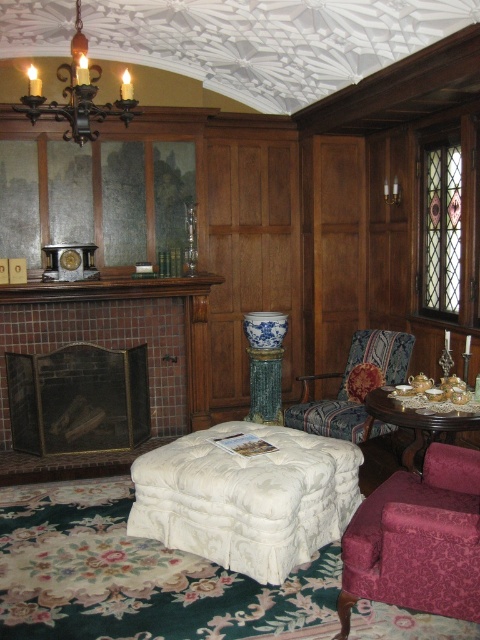
How distant is polished brass chandelier at upper left from wooden polished table at center?

polished brass chandelier at upper left is 2.44 meters away from wooden polished table at center.

Is polished brass chandelier at upper left below wooden polished table at center?

No.

What are the coordinates of `polished brass chandelier at upper left` in the screenshot? It's located at (79, 93).

Locate an element on the screen. The image size is (480, 640). polished brass chandelier at upper left is located at coordinates (79, 93).

Between point (200, 396) and point (370, 429), which one is positioned in front?

Point (370, 429) is in front.

Can you confirm if brass fire screen at left is positioned below wooden polished table at center?

Incorrect, brass fire screen at left is not positioned below wooden polished table at center.

Describe the element at coordinates (120, 333) in the screenshot. The width and height of the screenshot is (480, 640). I see `brass fire screen at left` at that location.

Identify the location of brass fire screen at left. tap(120, 333).

Does velvet maroon armchair at lower right come behind velvet floral-patterned armchair at center?

No, velvet maroon armchair at lower right is closer to the viewer.

Consider the image. Is velvet maroon armchair at lower right bigger than velvet floral-patterned armchair at center?

No.

Does point (432, 522) lie in front of point (297, 422)?

Yes, point (432, 522) is closer to viewer.

Identify the location of velvet maroon armchair at lower right. The width and height of the screenshot is (480, 640). (418, 540).